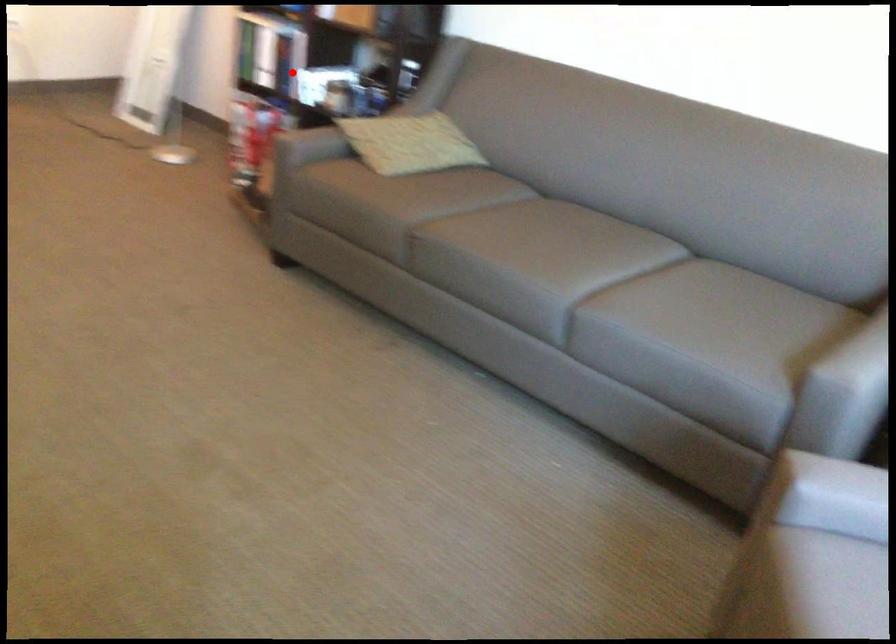
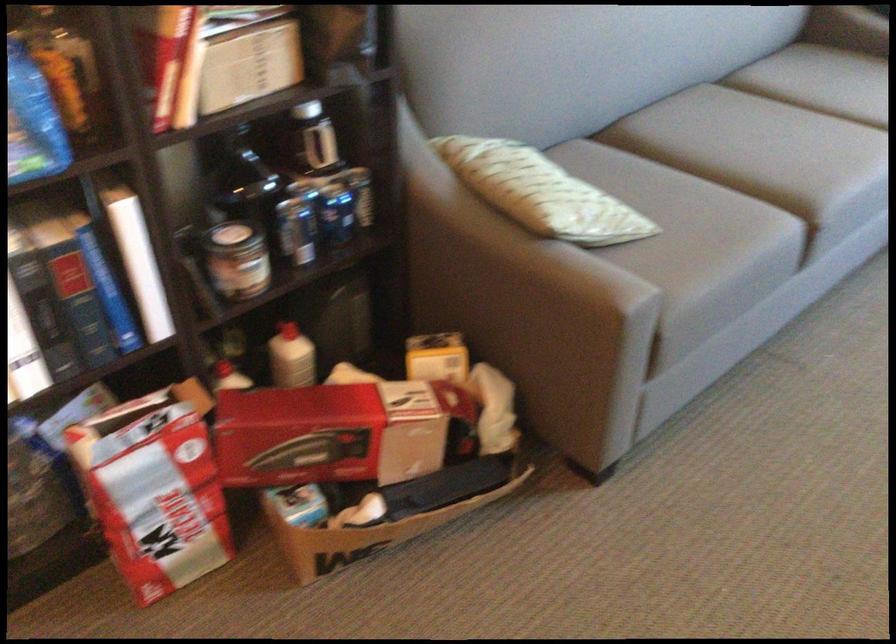
Find the pixel in the second image that matches the highlighted location in the first image.

(237, 260)